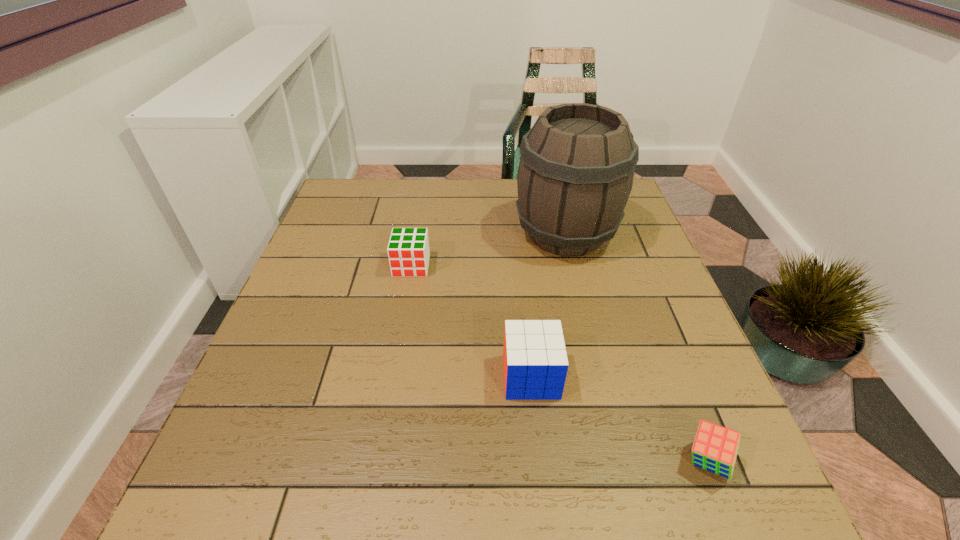
In the image, there is a desktop. In order to click on vacant space at the right edge in this screenshot , I will do `click(700, 365)`.

In the image, there is a desktop. Where is `free space at the far left corner`? free space at the far left corner is located at coordinates (376, 184).

Image resolution: width=960 pixels, height=540 pixels. I want to click on vacant space at the near left corner, so click(x=229, y=474).

Find the location of `vacant area at the near right corner of the desktop`. vacant area at the near right corner of the desktop is located at coordinates (758, 502).

Where is `free space that is in between the wine bucket and the farthest cube`? This screenshot has width=960, height=540. free space that is in between the wine bucket and the farthest cube is located at coordinates (489, 250).

At what (x,y) coordinates should I click in order to perform the action: click on vacant region between the second nearest object and the nearest object. Please return your answer as a coordinate pair (x, y). This screenshot has width=960, height=540. Looking at the image, I should click on (619, 418).

The image size is (960, 540). Identify the location of free spot between the tallest object and the leftmost object. (489, 250).

I want to click on free space between the wine bucket and the leftmost object, so click(489, 250).

Where is `free space between the third shortest object and the nearest cube`? free space between the third shortest object and the nearest cube is located at coordinates (619, 418).

Image resolution: width=960 pixels, height=540 pixels. Identify the location of empty space between the leftmost cube and the wine bucket. (489, 250).